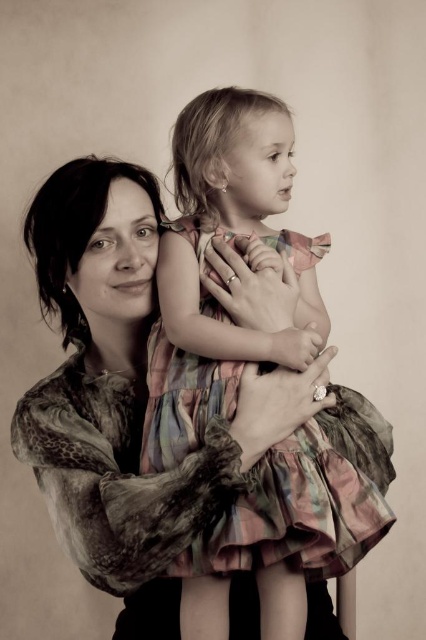
You are a fashion designer observing the scene. You notice the plaid fabric dress at center. Can you determine its exact location in the image using coordinates?

The plaid fabric dress at center is located at coordinates point [227,269].

You are an observer looking at the scene. There is a plaid fabric dress at center and a printed silk blouse at center. Which clothing item is positioned more to the right?

The plaid fabric dress at center is positioned more to the right than the printed silk blouse at center.